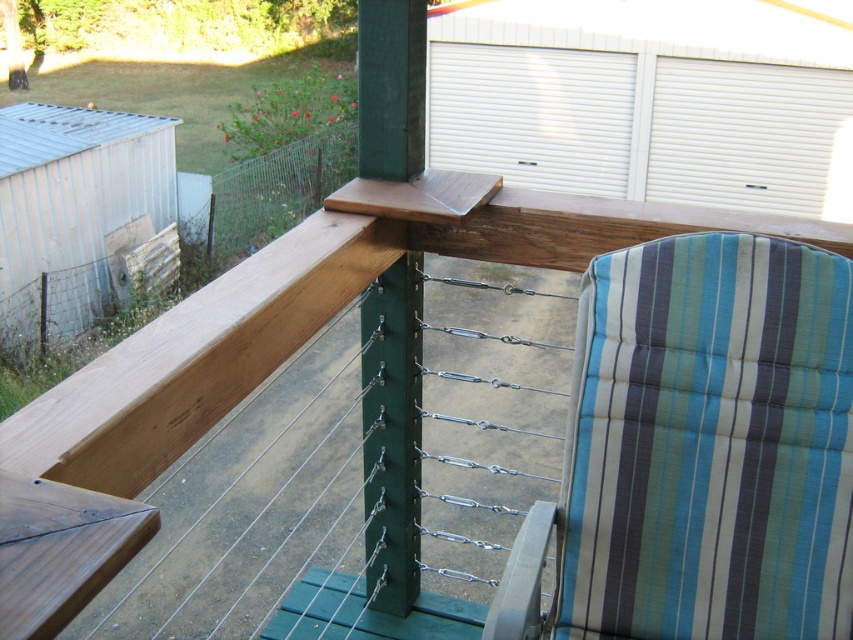
Question: Which of the following is the closest to the observer?

Choices:
 (A) wooden rail at upper center
 (B) green matte pole at center
 (C) striped fabric beach chair at right

Answer: (A)

Question: Is striped fabric beach chair at right wider than green matte pole at center?

Choices:
 (A) yes
 (B) no

Answer: (A)

Question: Among these objects, which one is farthest from the camera?

Choices:
 (A) green matte pole at center
 (B) striped fabric beach chair at right
 (C) wooden rail at upper center

Answer: (A)

Question: Can you confirm if striped fabric beach chair at right is smaller than wooden rail at upper center?

Choices:
 (A) yes
 (B) no

Answer: (A)

Question: Which of the following is the closest to the observer?

Choices:
 (A) (210, 333)
 (B) (650, 490)
 (C) (369, 3)

Answer: (A)

Question: Is striped fabric beach chair at right to the left of wooden rail at upper center from the viewer's perspective?

Choices:
 (A) no
 (B) yes

Answer: (A)